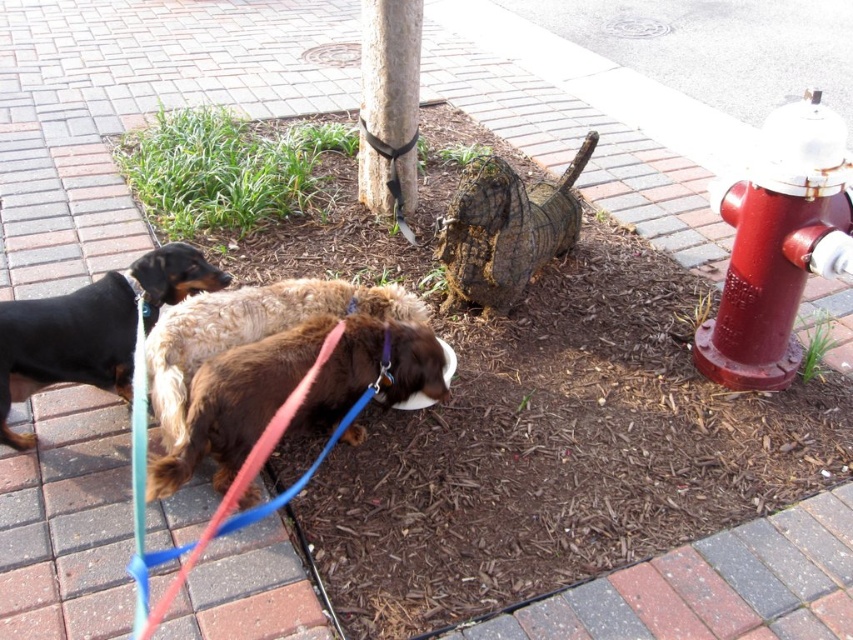
Based on the photo, you are a dog owner holding a 3.5 feet long leash. Your black smooth dog at left is currently near the red metallic hydrant at right. Can you safely walk your dog around the hydrant without the leash becoming taut?

The red metallic hydrant at right is 6.12 feet from the black smooth dog at left. Since your leash is only 3.5 feet long, the distance between them exceeds the leash length. This means the leash will become taut if you try to move the dog closer to the hydrant. Therefore, you cannot safely walk your dog around the hydrant without the leash tightening.

You are a dog owner trying to decide if your new dog can fit under a fence that is as tall as the smooth brown pole at center. Based on the scene, can your dog, which is the same size as the brown fuzzy dog at center, fit under the fence?

The brown fuzzy dog at center has a lesser height compared to the smooth brown pole at center, so your dog can fit under the fence since it is shorter than the pole.

You are a dog owner walking your black smooth dog at left and need to secure it to the red metallic hydrant at right. Given that the leash is 1.5 meters long, will the dog be able to reach the hydrant without moving closer?

The red metallic hydrant at right is taller than the black smooth dog at left. However, the leash length of 1.5 meters would determine reach. Since the question doesn not provide distance between them, we cannot confirm if the dog can reach the hydrant.